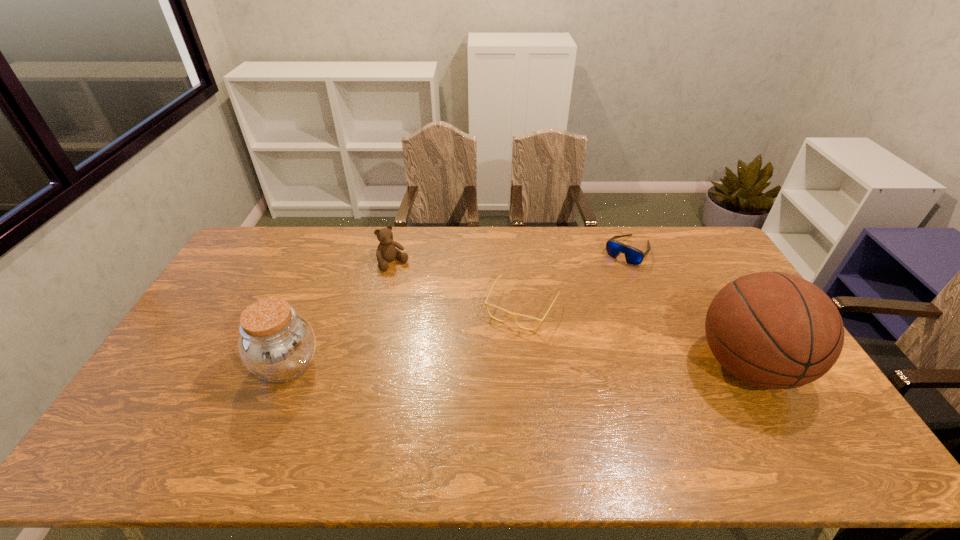
This screenshot has width=960, height=540. Identify the location of the leftmost object. (277, 344).

Where is `jar`? The width and height of the screenshot is (960, 540). jar is located at coordinates (277, 344).

Where is `basketball`? The height and width of the screenshot is (540, 960). basketball is located at coordinates 774,330.

The image size is (960, 540). I want to click on teddy bear, so click(x=386, y=251).

Identify the location of the second object from left to right. The height and width of the screenshot is (540, 960). (386, 251).

Where is `sunglasses`? sunglasses is located at coordinates (633, 256).

Locate an element on the screen. Image resolution: width=960 pixels, height=540 pixels. spectacles is located at coordinates (509, 313).

The image size is (960, 540). I want to click on the shortest object, so click(509, 313).

Where is `free space located 0.130m on the right of the leftmost object`? The width and height of the screenshot is (960, 540). free space located 0.130m on the right of the leftmost object is located at coordinates (367, 364).

The height and width of the screenshot is (540, 960). What are the coordinates of `vacant area situated 0.360m on the front-facing side of the fourth object from right to left` in the screenshot? It's located at (455, 334).